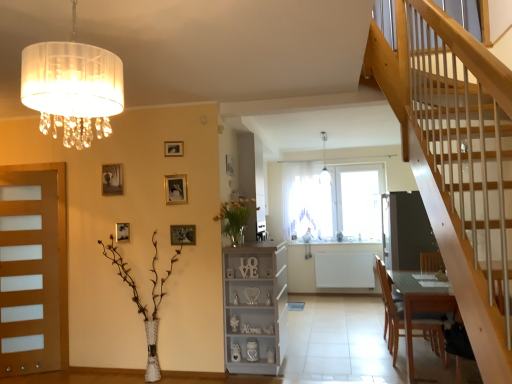
I want to click on free space above wooden door at left (from a real-world perspective), so click(x=26, y=167).